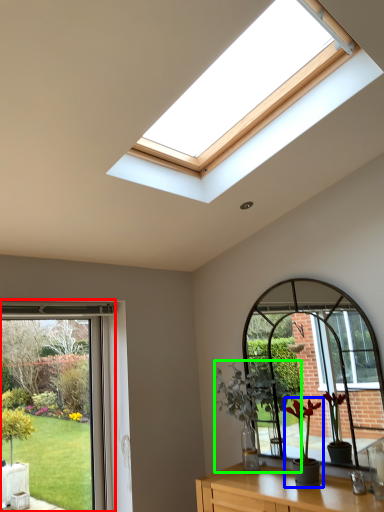
Question: Which object is the closest to the window (highlighted by a red box)? Choose among these: houseplant (highlighted by a blue box) or houseplant (highlighted by a green box).

Choices:
 (A) houseplant
 (B) houseplant

Answer: (B)